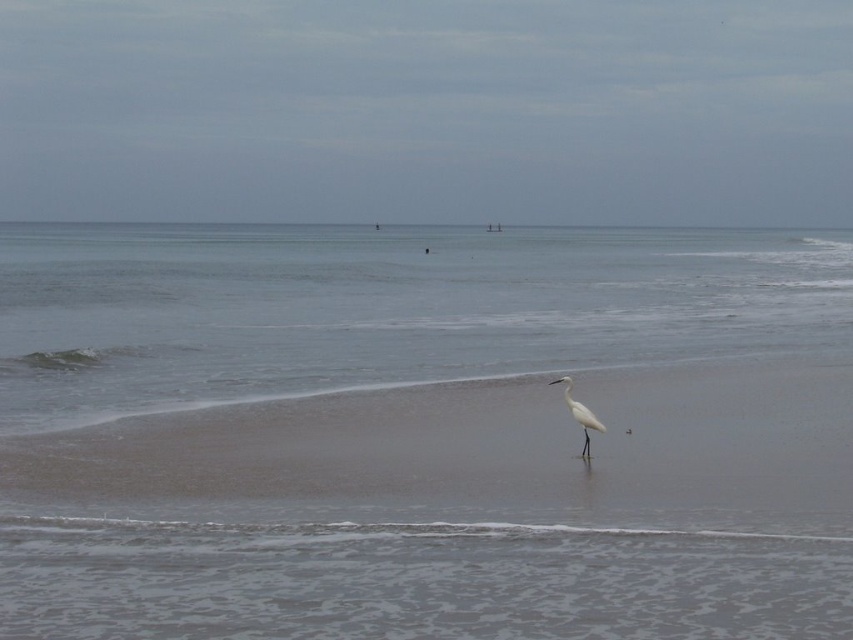
Question: Where is clear water at center located in relation to white matte bird at center in the image?

Choices:
 (A) below
 (B) above

Answer: (B)

Question: Is smooth sand at center to the left of white matte bird at center from the viewer's perspective?

Choices:
 (A) no
 (B) yes

Answer: (B)

Question: Which is farther from the clear water at center?

Choices:
 (A) white matte bird at center
 (B) smooth sand at center

Answer: (A)

Question: Which object is farther from the camera taking this photo?

Choices:
 (A) clear water at center
 (B) smooth sand at center

Answer: (B)

Question: Does smooth sand at center appear over white matte bird at center?

Choices:
 (A) no
 (B) yes

Answer: (B)

Question: Which point is farther to the camera?

Choices:
 (A) (x=184, y=444)
 (B) (x=585, y=442)
 (C) (x=361, y=500)

Answer: (A)